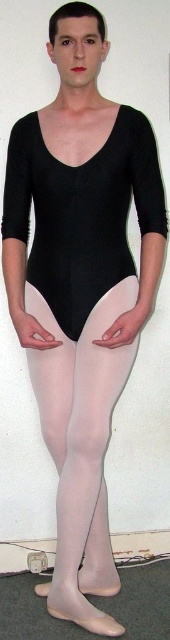
Who is lower down, black matte leotard at center or sheer white tights at center?

sheer white tights at center

Is point (63, 212) behind point (43, 317)?

No, it is in front of (43, 317).

Image resolution: width=170 pixels, height=640 pixels. I want to click on black matte leotard at center, so click(x=81, y=212).